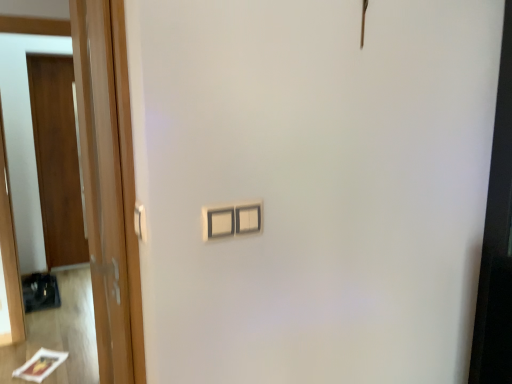
Question: Is wooden door at left wider or thinner than white plastic light switch at center?

Choices:
 (A) thin
 (B) wide

Answer: (B)

Question: In terms of size, does wooden door at left appear bigger or smaller than white plastic light switch at center?

Choices:
 (A) small
 (B) big

Answer: (B)

Question: Which object is positioned closest to the white plastic light switch at center?

Choices:
 (A) wooden door at left, which is the 1th door from front to back
 (B) white plastic door handle at left
 (C) wooden door at left
 (D) wooden door at left, which ranks as the 1th door in back-to-front order

Answer: (B)

Question: Based on their relative distances, which object is farther from the white plastic door handle at left?

Choices:
 (A) wooden door at left
 (B) white plastic light switch at center
 (C) wooden door at left, acting as the 2th door starting from the back
 (D) wooden door at left, which ranks as the 1th door in back-to-front order

Answer: (D)